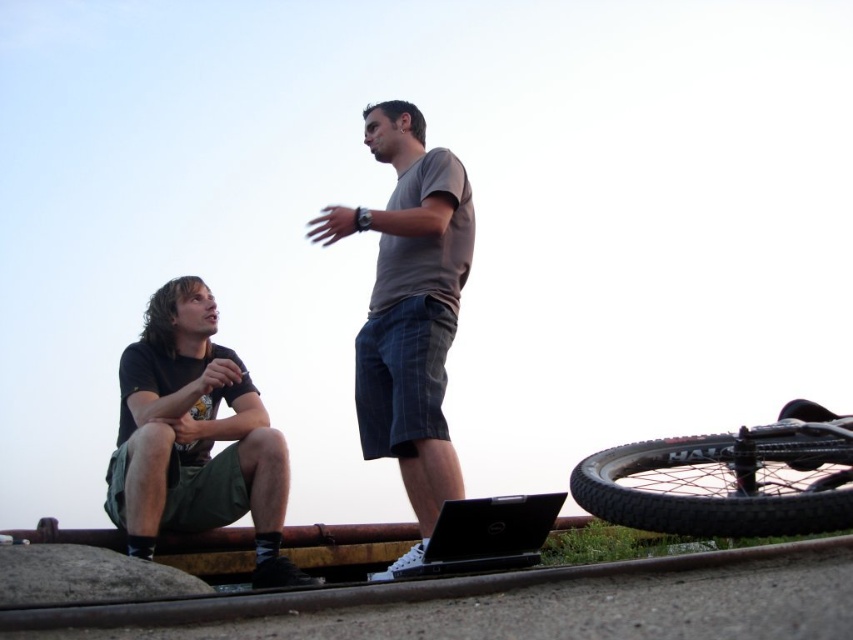
Based on the photo, is matte gray t-shirt at center taller than black rubber tire at lower right?

Yes, matte gray t-shirt at center is taller than black rubber tire at lower right.

Between point (409, 472) and point (792, 460), which one is positioned in front?

Point (792, 460) is more forward.

You are a GUI agent. You are given a task and a screenshot of the screen. Output one action in this format:
    pyautogui.click(x=<x>, y=<y>)
    Task: Click on the matte gray t-shirt at center
    
    Given the screenshot: What is the action you would take?
    pyautogui.click(x=409, y=308)

Is black rubber tire at lower right above black matte laptop at lower center?

Yes, black rubber tire at lower right is above black matte laptop at lower center.

Can you confirm if black rubber tire at lower right is positioned to the left of black matte laptop at lower center?

Incorrect, black rubber tire at lower right is not on the left side of black matte laptop at lower center.

Where is `black rubber tire at lower right`? black rubber tire at lower right is located at coordinates (728, 480).

Which is in front, point (186, 506) or point (462, 554)?

Point (462, 554)

Measure the distance from dark green cotton shorts at left to black matte laptop at lower center.

A distance of 11.87 feet exists between dark green cotton shorts at left and black matte laptop at lower center.

What do you see at coordinates (195, 436) in the screenshot? I see `dark green cotton shorts at left` at bounding box center [195, 436].

Find the location of a particular element. This screenshot has height=640, width=853. dark green cotton shorts at left is located at coordinates (195, 436).